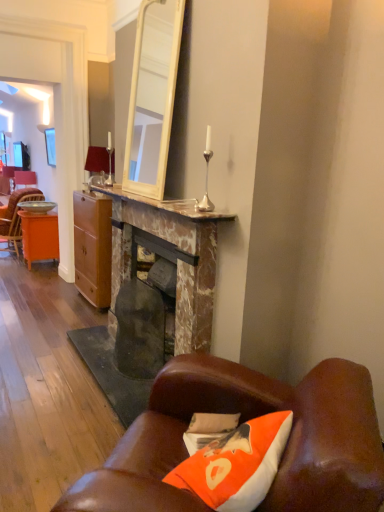
Question: Is orange wood desk at left thinner than matte wood cabinet at center?

Choices:
 (A) no
 (B) yes

Answer: (A)

Question: Can we say orange wood desk at left lies outside matte wood cabinet at center?

Choices:
 (A) no
 (B) yes

Answer: (B)

Question: Can you confirm if orange wood desk at left is smaller than matte wood cabinet at center?

Choices:
 (A) yes
 (B) no

Answer: (A)

Question: Is orange wood desk at left at the right side of matte wood cabinet at center?

Choices:
 (A) yes
 (B) no

Answer: (B)

Question: Are orange wood desk at left and matte wood cabinet at center beside each other?

Choices:
 (A) no
 (B) yes

Answer: (A)

Question: Considering the relative sizes of orange wood desk at left and matte wood cabinet at center in the image provided, is orange wood desk at left taller than matte wood cabinet at center?

Choices:
 (A) no
 (B) yes

Answer: (A)

Question: Is orange fabric pillow at lower right not close to orange wood desk at left?

Choices:
 (A) no
 (B) yes

Answer: (B)

Question: From a real-world perspective, is orange fabric pillow at lower right on top of orange wood desk at left?

Choices:
 (A) yes
 (B) no

Answer: (A)

Question: Can you confirm if orange fabric pillow at lower right is thinner than orange wood desk at left?

Choices:
 (A) no
 (B) yes

Answer: (B)

Question: Is orange fabric pillow at lower right shorter than orange wood desk at left?

Choices:
 (A) yes
 (B) no

Answer: (A)

Question: Are orange fabric pillow at lower right and orange wood desk at left beside each other?

Choices:
 (A) no
 (B) yes

Answer: (A)

Question: Is orange fabric pillow at lower right positioned behind orange wood desk at left?

Choices:
 (A) yes
 (B) no

Answer: (B)

Question: Are leather couch at lower right and marble fireplace at center far apart?

Choices:
 (A) yes
 (B) no

Answer: (B)